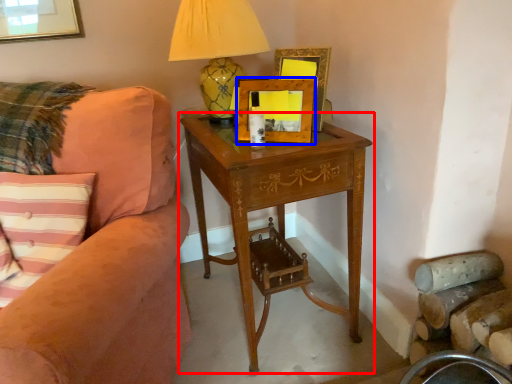
Question: Among these objects, which one is farthest to the camera, nightstand (highlighted by a red box) or picture frame (highlighted by a blue box)?

Choices:
 (A) nightstand
 (B) picture frame

Answer: (B)